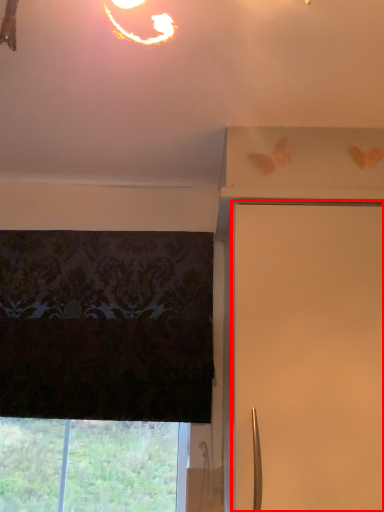
Question: Observing the image, what is the correct spatial positioning of shutter (annotated by the red box) in reference to window?

Choices:
 (A) left
 (B) right

Answer: (B)